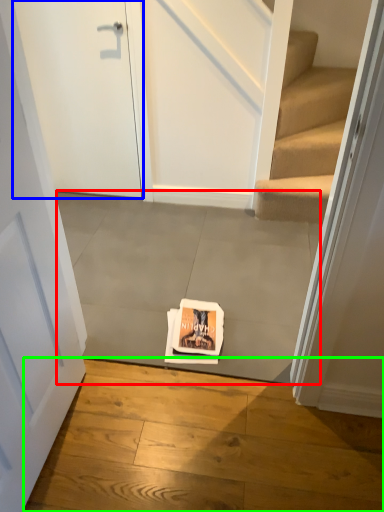
Question: Which object is the closest to the concrete (highlighted by a red box)? Choose among these: door (highlighted by a blue box) or concrete (highlighted by a green box).

Choices:
 (A) door
 (B) concrete

Answer: (B)